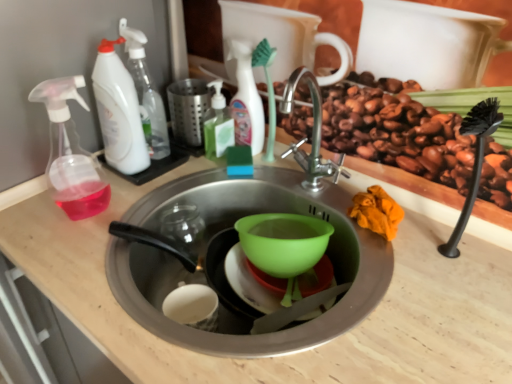
Where is `free space to the left of transparent plastic spray bottle at left`? free space to the left of transparent plastic spray bottle at left is located at coordinates (36, 211).